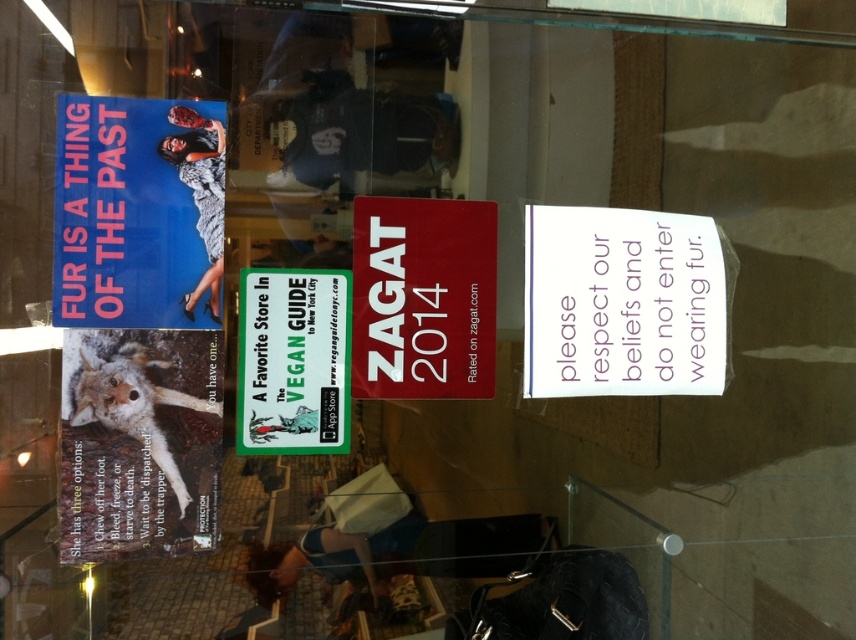
Is the position of white fur poster at left less distant than that of matte red sign at center?

Yes.

Is point (174, 550) behind point (468, 236)?

No.

Is point (102, 429) farther from camera compared to point (437, 356)?

No, (102, 429) is closer to viewer.

Image resolution: width=856 pixels, height=640 pixels. I want to click on white fur poster at left, so click(138, 442).

Who is more distant from viewer, (489, 230) or (305, 410)?

The point (489, 230) is more distant.

Is point (352, 260) farther from viewer compared to point (310, 444)?

Yes, point (352, 260) is farther from viewer.

Where is `matte red sign at center`? The image size is (856, 640). matte red sign at center is located at coordinates (423, 298).

Can you confirm if white paper sign at center is positioned above green paper sign at center?

Yes.

Consider the image. Who is positioned more to the right, white paper sign at center or green paper sign at center?

white paper sign at center

Where is `white paper sign at center`? The width and height of the screenshot is (856, 640). white paper sign at center is located at coordinates (623, 301).